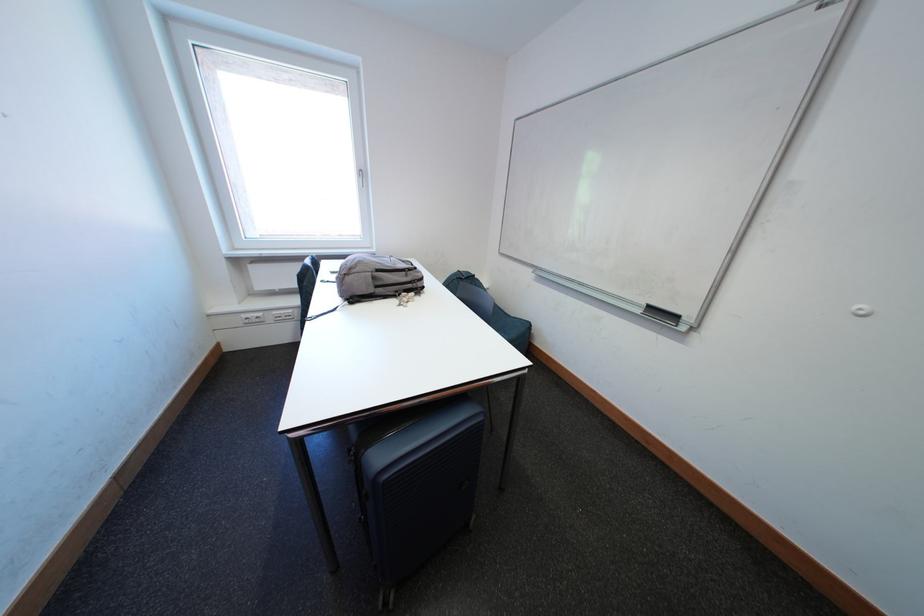
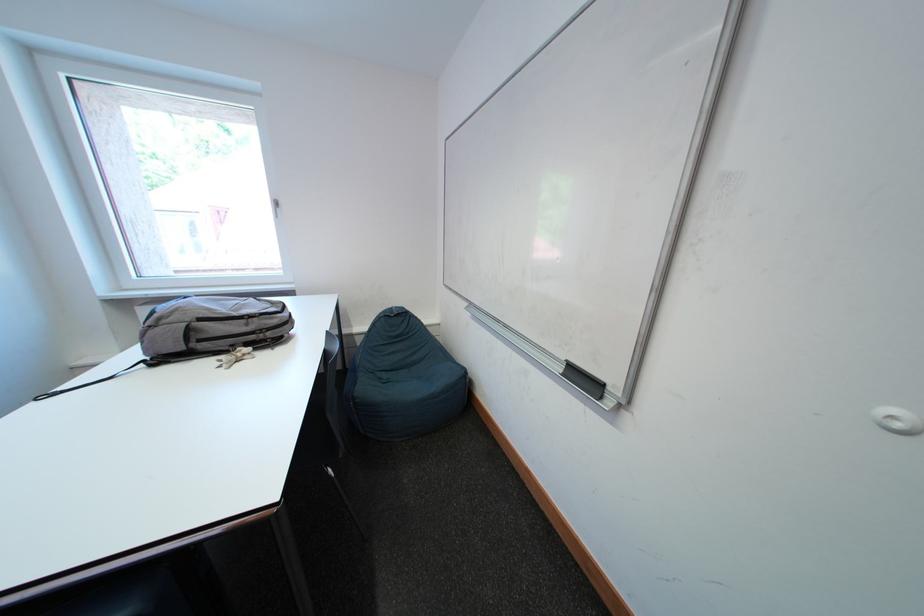
Question: The images are taken continuously from a first-person perspective. In which direction is your viewpoint rotating?

Choices:
 (A) Left
 (B) Right
 (C) Up
 (D) Down

Answer: (C)